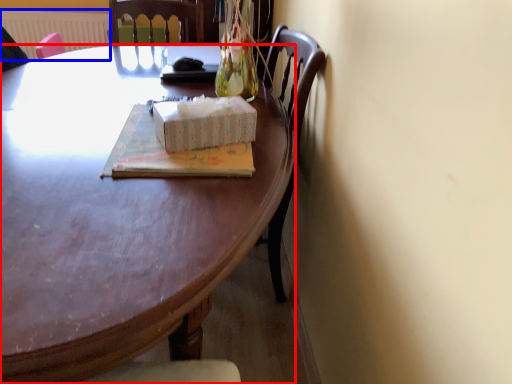
Question: Which object is further to the camera taking this photo, desk (highlighted by a red box) or radiator (highlighted by a blue box)?

Choices:
 (A) desk
 (B) radiator

Answer: (B)